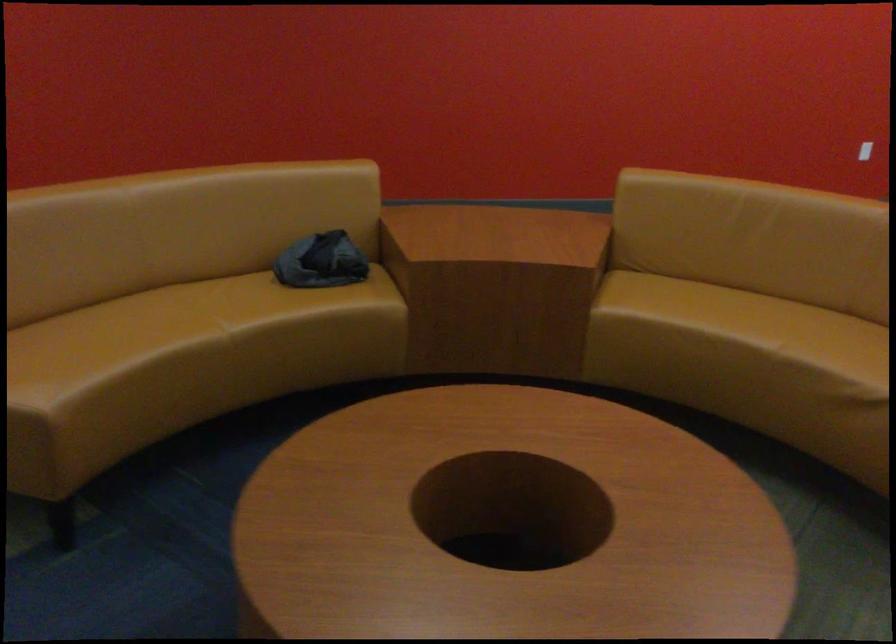
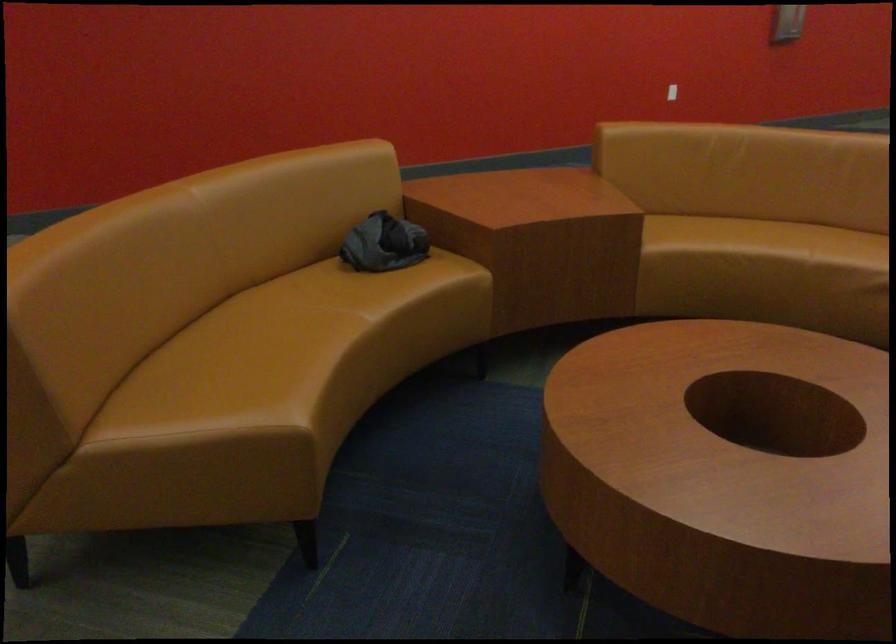
In the second image, find the point that corresponds to point 685,314 in the first image.

(719, 242)